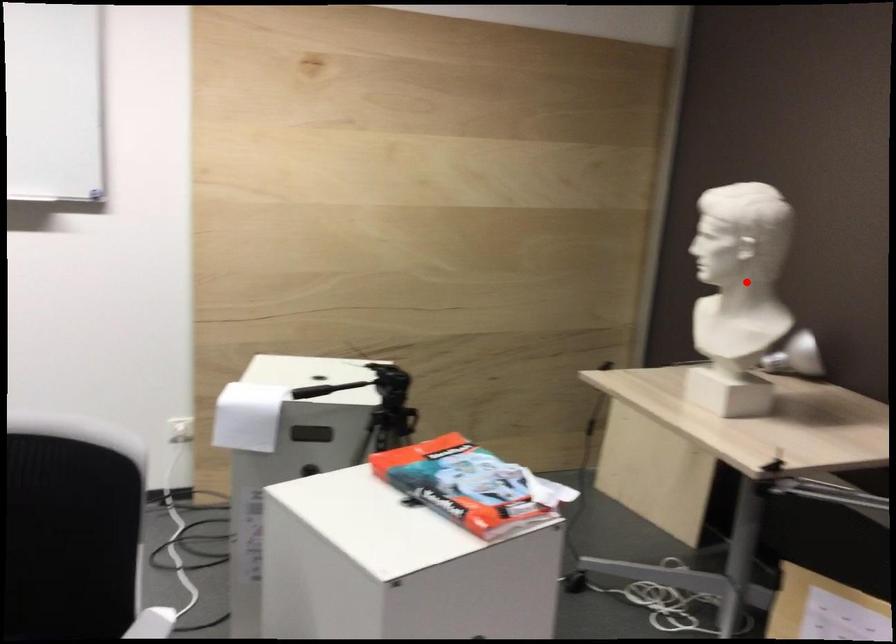
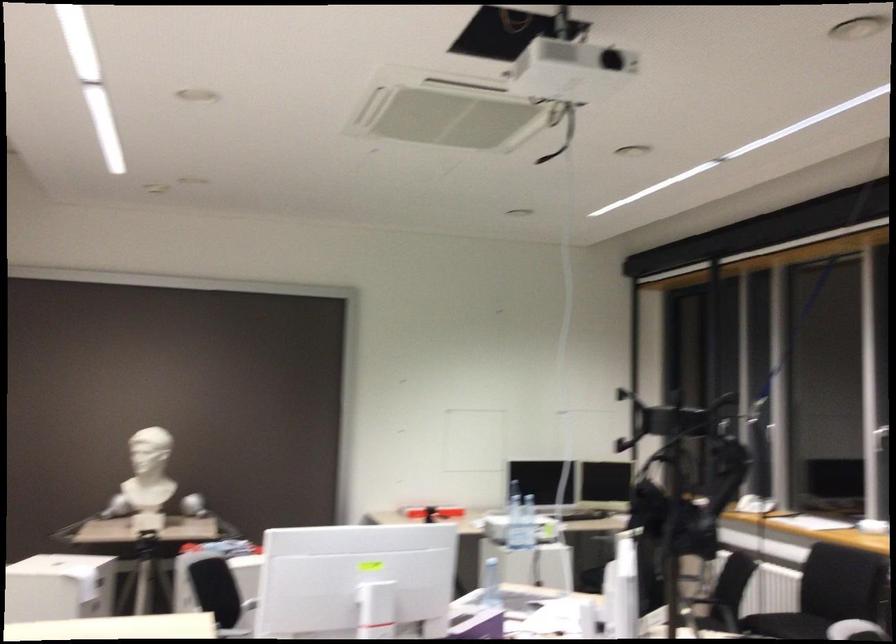
Question: A red point is marked in image1. In image2, is the corresponding 3D point closer to the camera or farther? Reply with the corresponding letter.

Choices:
 (A) The corresponding 3D point is closer.
 (B) The corresponding 3D point is farther.

Answer: (B)